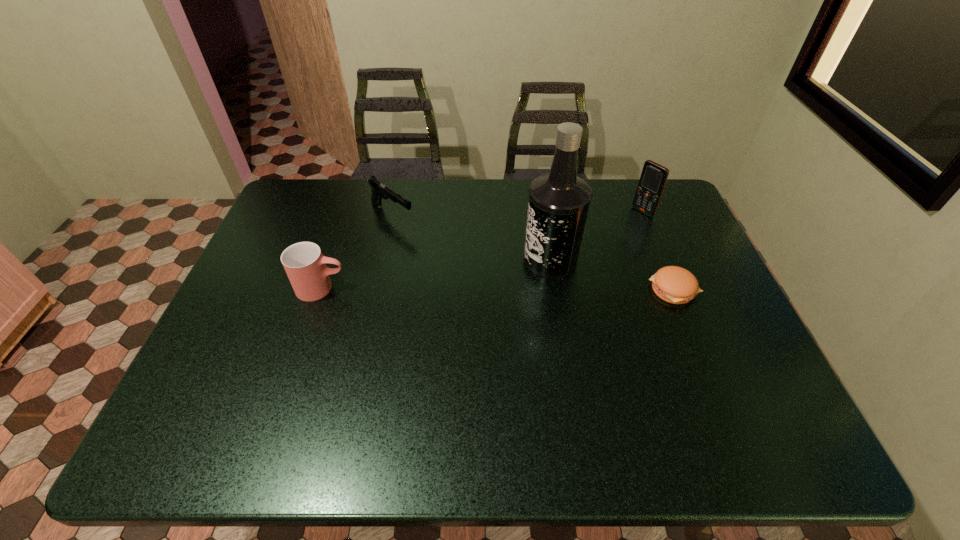
Where is `patty located at the right edge`? This screenshot has width=960, height=540. patty located at the right edge is located at coordinates (673, 284).

Locate an element on the screen. cellular telephone that is at the right edge is located at coordinates (653, 178).

Locate an element on the screen. This screenshot has height=540, width=960. object that is at the far right corner is located at coordinates (653, 178).

Locate an element on the screen. The width and height of the screenshot is (960, 540). free region at the far edge of the desktop is located at coordinates click(x=509, y=195).

In the image, there is a desktop. Identify the location of vacant space at the left edge. (272, 252).

This screenshot has height=540, width=960. In the image, there is a desktop. What are the coordinates of `vacant space at the right edge` in the screenshot? It's located at (676, 258).

The image size is (960, 540). In order to click on vacant space at the far right corner in this screenshot , I will do `click(634, 193)`.

Locate an element on the screen. The height and width of the screenshot is (540, 960). vacant area between the second tallest object and the cup is located at coordinates (482, 250).

Identify the location of blank region between the gun and the cup. (357, 252).

Identify the location of free space between the cup and the second tallest object. Image resolution: width=960 pixels, height=540 pixels. (482, 250).